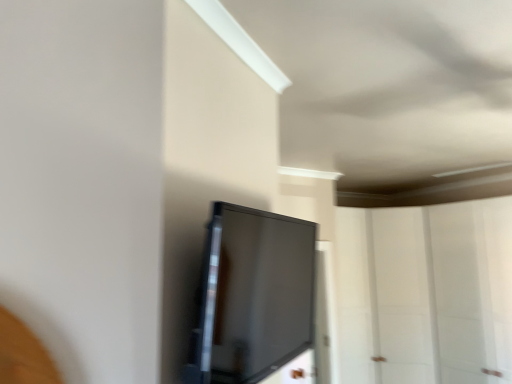
Question: Is point (298, 286) closer or farther from the camera than point (492, 331)?

Choices:
 (A) closer
 (B) farther

Answer: (A)

Question: From a real-world perspective, is matte black screen at center above or below transparent glass door at center?

Choices:
 (A) above
 (B) below

Answer: (A)

Question: Considering the positions of matte black screen at center and transparent glass door at center in the image, is matte black screen at center taller or shorter than transparent glass door at center?

Choices:
 (A) short
 (B) tall

Answer: (A)

Question: Is transparent glass door at center in front of or behind matte black screen at center in the image?

Choices:
 (A) behind
 (B) front

Answer: (A)

Question: From the image's perspective, relative to matte black screen at center, is transparent glass door at center above or below?

Choices:
 (A) below
 (B) above

Answer: (A)

Question: Is transparent glass door at center taller or shorter than matte black screen at center?

Choices:
 (A) short
 (B) tall

Answer: (B)

Question: Based on their sizes in the image, would you say transparent glass door at center is bigger or smaller than matte black screen at center?

Choices:
 (A) big
 (B) small

Answer: (A)